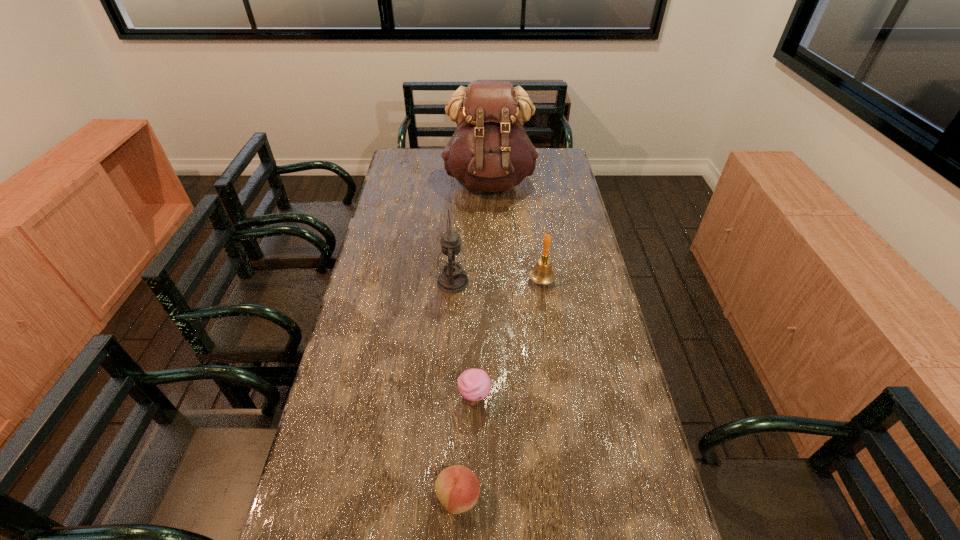
Image resolution: width=960 pixels, height=540 pixels. In order to click on satchel in this screenshot , I will do `click(490, 151)`.

Where is `the farthest object`? The height and width of the screenshot is (540, 960). the farthest object is located at coordinates (490, 151).

You are a GUI agent. You are given a task and a screenshot of the screen. Output one action in this format:
    pyautogui.click(x=<x>, y=<y>)
    Task: Click on the second tallest object
    The height and width of the screenshot is (540, 960).
    Given the screenshot: What is the action you would take?
    pyautogui.click(x=452, y=279)

This screenshot has width=960, height=540. What are the coordinates of `the third shortest object` in the screenshot? It's located at (542, 273).

This screenshot has height=540, width=960. Identify the location of cupcake. (474, 385).

You are a GUI agent. You are given a task and a screenshot of the screen. Output one action in this format:
    pyautogui.click(x=<x>, y=<y>)
    Task: Click on the nearest object
    
    Given the screenshot: What is the action you would take?
    pyautogui.click(x=457, y=488)

You are a GUI agent. You are given a task and a screenshot of the screen. Output one action in this format:
    pyautogui.click(x=<x>, y=<y>)
    Task: Click on the free space located at the front of the tallest object with buckles
    The image size is (960, 540).
    Given the screenshot: What is the action you would take?
    pyautogui.click(x=491, y=224)

At what (x,y) coordinates should I click in order to perform the action: click on vacant region located 0.400m on the front of the fourth shortest object. Please return your answer as a coordinate pair (x, y). Looking at the image, I should click on coord(445,404).

Locate an element on the screen. The height and width of the screenshot is (540, 960). free region located 0.070m on the left of the bell is located at coordinates (508, 280).

Where is `free space located 0.280m on the left of the cupcake`? The image size is (960, 540). free space located 0.280m on the left of the cupcake is located at coordinates (354, 398).